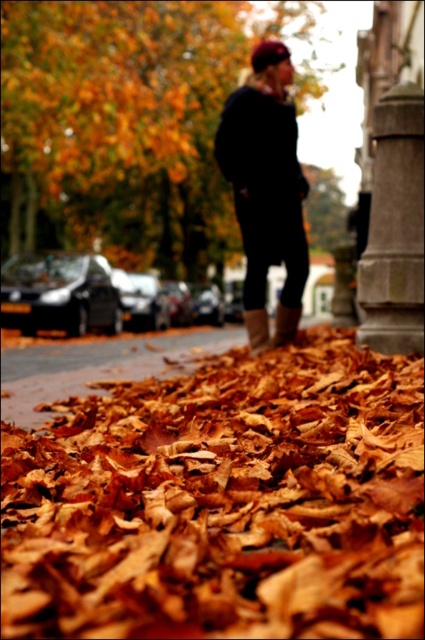
Question: Which of the following is the farthest from the observer?

Choices:
 (A) (280, 320)
 (B) (399, 241)

Answer: (A)

Question: Considering the real-world distances, which object is farthest from the brown dried leaves at lower center?

Choices:
 (A) dark blue sweater at center
 (B) leather boot at lower center
 (C) brown suede boot at center

Answer: (A)

Question: Which point is farther to the camera?

Choices:
 (A) (414, 324)
 (B) (37, 369)
 (C) (362, 380)
 (D) (53, 68)

Answer: (D)

Question: Does brown dried leaves at lower center appear on the right side of gray stone pillar at right?

Choices:
 (A) no
 (B) yes

Answer: (A)

Question: Is the position of gray stone pillar at right less distant than that of brown suede boot at center?

Choices:
 (A) no
 (B) yes

Answer: (B)

Question: Is gray stone pillar at right positioned behind leather boot at lower center?

Choices:
 (A) yes
 (B) no

Answer: (B)